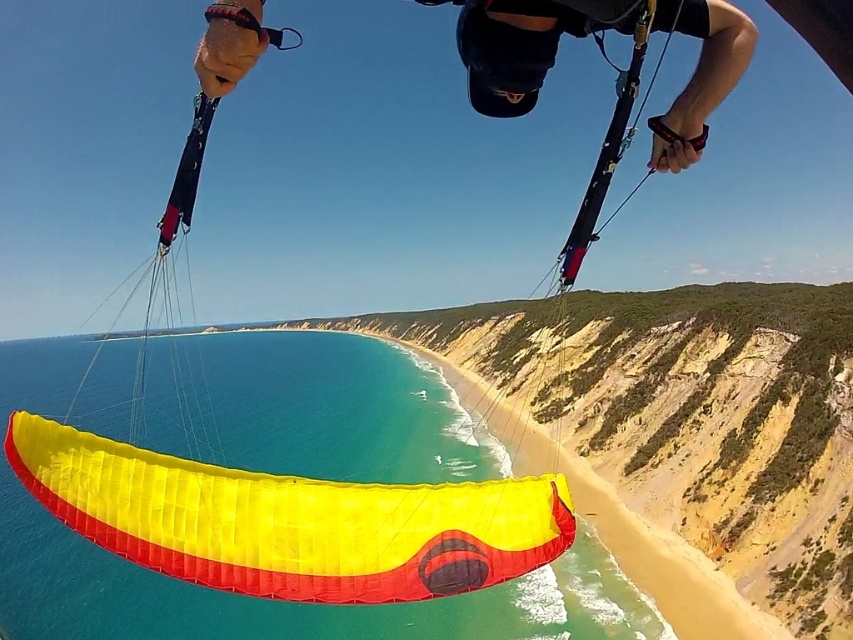
Question: Which object is farther from the camera taking this photo?

Choices:
 (A) yellow fabric parasail at lower center
 (B) yellow fabric parachute at center

Answer: (A)

Question: Is yellow fabric parachute at center thinner than black matte helmet at upper center?

Choices:
 (A) yes
 (B) no

Answer: (B)

Question: Does yellow fabric parachute at center appear on the left side of yellow fabric parasail at lower center?

Choices:
 (A) no
 (B) yes

Answer: (A)

Question: Which point is farther to the camera?

Choices:
 (A) (219, 65)
 (B) (241, 497)

Answer: (B)

Question: Considering the relative positions of yellow fabric parasail at lower center and black matte helmet at upper center in the image provided, where is yellow fabric parasail at lower center located with respect to black matte helmet at upper center?

Choices:
 (A) right
 (B) left

Answer: (B)

Question: Considering the real-world distances, which object is farthest from the yellow fabric parasail at lower center?

Choices:
 (A) black matte helmet at upper center
 (B) yellow fabric parachute at center

Answer: (A)